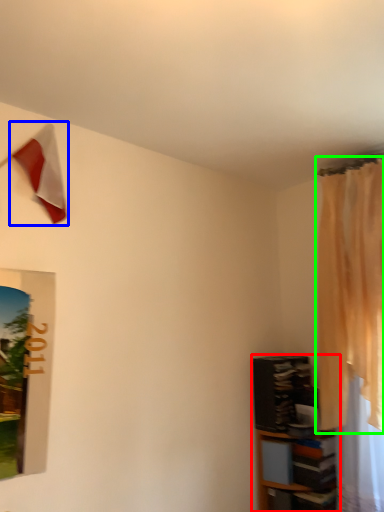
Question: Which object is the closest to the shelf (highlighted by a red box)? Choose among these: flag (highlighted by a blue box) or curtain (highlighted by a green box).

Choices:
 (A) flag
 (B) curtain

Answer: (B)